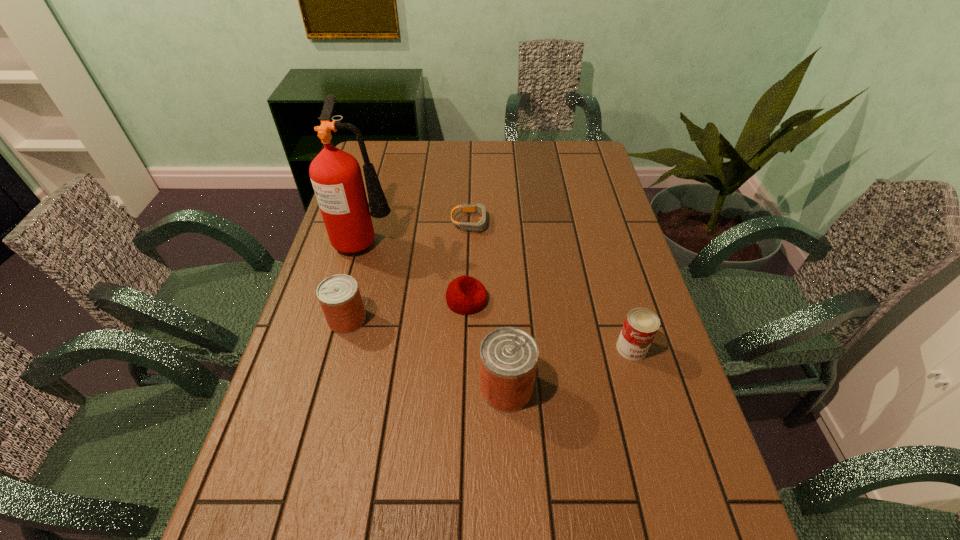
This screenshot has height=540, width=960. Find the location of `free spot between the nearest object and the fire extinguisher`. free spot between the nearest object and the fire extinguisher is located at coordinates (436, 314).

This screenshot has width=960, height=540. I want to click on blank region between the tallest object and the goggles, so click(x=419, y=231).

Identify which object is the nearest to the beanbag. Please provide its 2D coordinates. Your answer should be formatted as a tuple, i.e. [(x, y)], where the tuple contains the x and y coordinates of a point satisfying the conditions above.

[(508, 356)]

Identify which object is the fourth closest to the leftmost can. Please provide its 2D coordinates. Your answer should be formatted as a tuple, i.e. [(x, y)], where the tuple contains the x and y coordinates of a point satisfying the conditions above.

[(480, 226)]

Identify which can is the nearest to the rightmost can. Please provide its 2D coordinates. Your answer should be formatted as a tuple, i.e. [(x, y)], where the tuple contains the x and y coordinates of a point satisfying the conditions above.

[(508, 356)]

The height and width of the screenshot is (540, 960). Identify the location of can that is the closest to the fifth farthest object. (508, 356).

Where is `vacant space that satisfies the following two spatial constraints: 1. on the back side of the tallest can; 2. on the front and back of the shortest object`? This screenshot has height=540, width=960. vacant space that satisfies the following two spatial constraints: 1. on the back side of the tallest can; 2. on the front and back of the shortest object is located at coordinates (498, 222).

Identify the location of vacant region that satisfies the following two spatial constraints: 1. at the nozzle of the fire extinguisher; 2. on the right side of the farthest can. (344, 320).

The width and height of the screenshot is (960, 540). Identify the location of free space that satisfies the following two spatial constraints: 1. on the back side of the second can from right to left; 2. on the front and back of the shortest object. (498, 222).

You are a GUI agent. You are given a task and a screenshot of the screen. Output one action in this format:
    pyautogui.click(x=<x>, y=<y>)
    Task: Click on the free location that satisfies the following two spatial constraints: 1. on the seat area of the fifth tallest object; 2. on the front side of the leftmost can
    
    Given the screenshot: What is the action you would take?
    pyautogui.click(x=466, y=320)